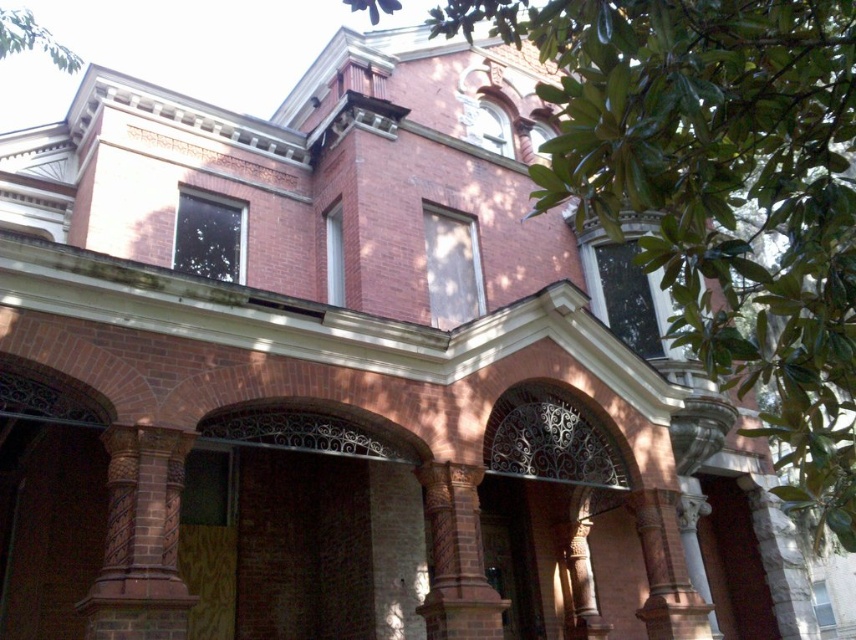
Question: Which of the following is the closest to the observer?

Choices:
 (A) brown stone column at center
 (B) brown textured column at center

Answer: (A)

Question: Does brown stone column at center have a smaller size compared to brown textured column at center?

Choices:
 (A) no
 (B) yes

Answer: (A)

Question: Where is brown stone column at center located in relation to brown textured column at center in the image?

Choices:
 (A) right
 (B) left

Answer: (B)

Question: Which of the following is the farthest from the observer?

Choices:
 (A) (489, 595)
 (B) (177, 518)

Answer: (A)

Question: From the image, what is the correct spatial relationship of brown stone column at center in relation to brown textured column at center?

Choices:
 (A) above
 (B) below

Answer: (A)